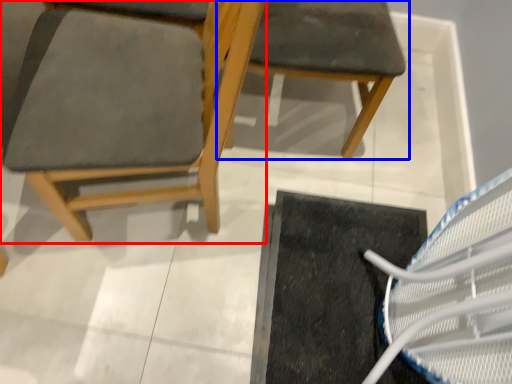
Question: Which point is closer to the camera, chair (highlighted by a red box) or chair (highlighted by a blue box)?

Choices:
 (A) chair
 (B) chair

Answer: (A)